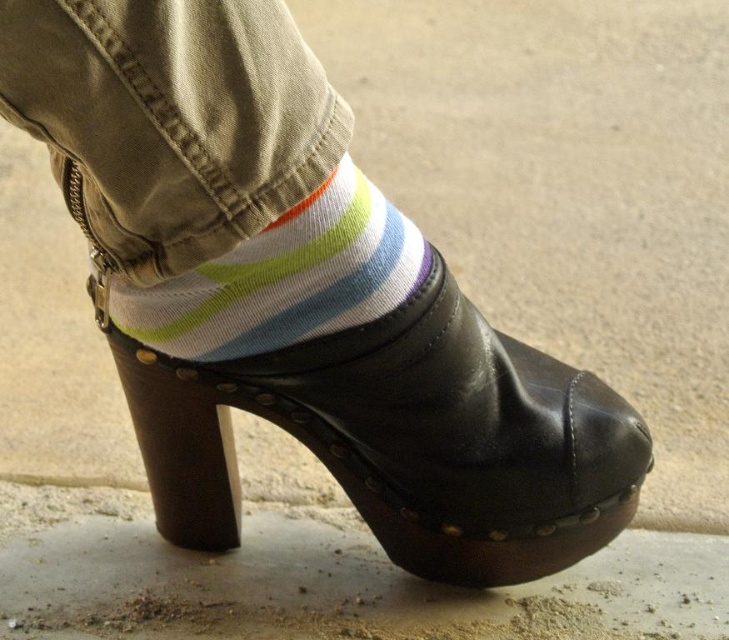
Question: Among these objects, which one is farthest from the camera?

Choices:
 (A) white striped sock at center
 (B) black leather clog at center

Answer: (B)

Question: Does black leather clog at center lie in front of white striped sock at center?

Choices:
 (A) no
 (B) yes

Answer: (A)

Question: Which point appears farthest from the camera in this image?

Choices:
 (A) (464, 406)
 (B) (327, 328)

Answer: (A)

Question: Where is black leather clog at center located in relation to white striped sock at center in the image?

Choices:
 (A) left
 (B) right

Answer: (B)

Question: Does black leather clog at center lie in front of white striped sock at center?

Choices:
 (A) no
 (B) yes

Answer: (A)